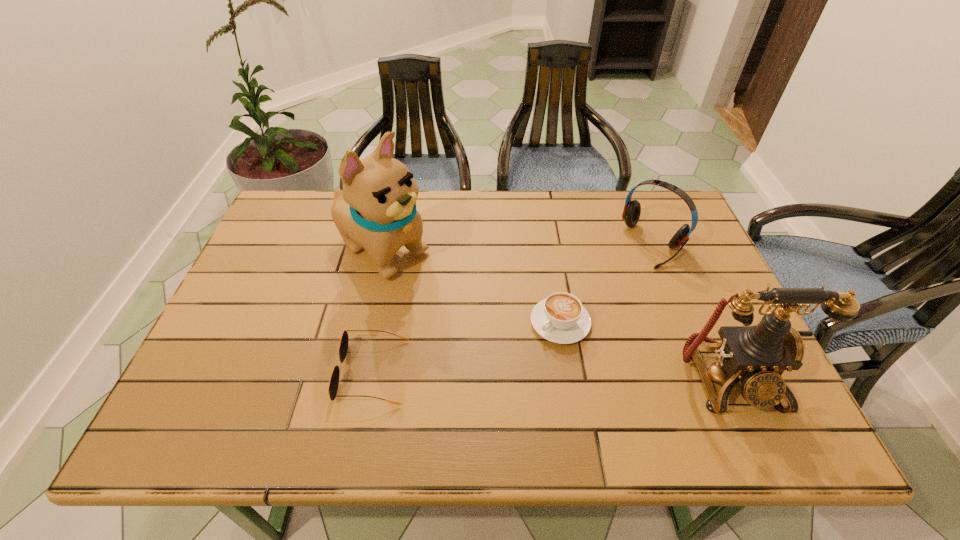
The width and height of the screenshot is (960, 540). Find the location of `vacant spot on the desktop that is between the sunglasses and the fourth shortest object and is positioned on the face of the tallest object`. vacant spot on the desktop that is between the sunglasses and the fourth shortest object and is positioned on the face of the tallest object is located at coordinates (577, 375).

Where is `free spot on the desktop that is between the sunglasses and the telephone and is positioned with the microphone attached to the side of the third shortest object`? Image resolution: width=960 pixels, height=540 pixels. free spot on the desktop that is between the sunglasses and the telephone and is positioned with the microphone attached to the side of the third shortest object is located at coordinates (515, 374).

Find the location of a particular element. vacant space on the desktop that is between the sunglasses and the second tallest object and is positioned on the side of the third object from right to left with the handle is located at coordinates (497, 374).